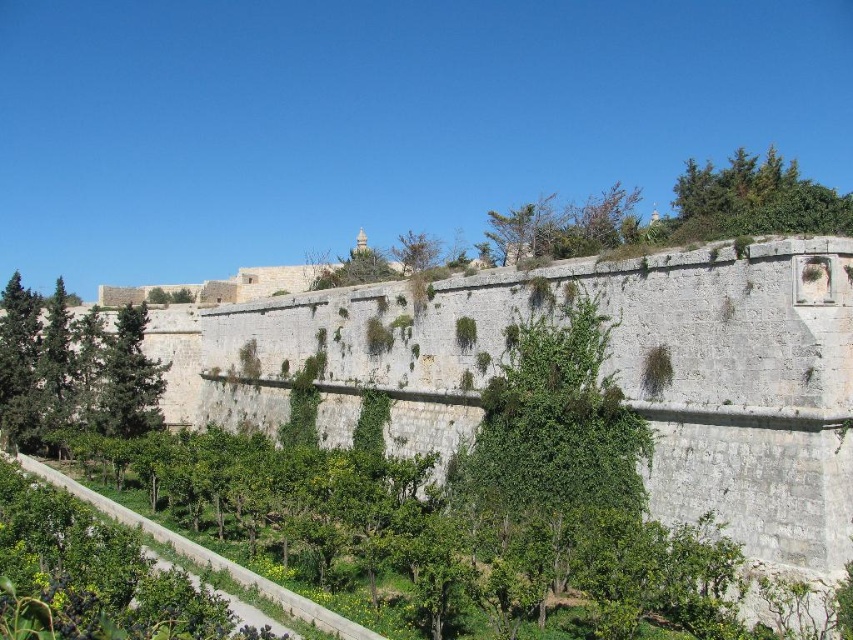
Question: Which point is farther to the camera?

Choices:
 (A) (703, 220)
 (B) (544, 458)
 (C) (404, 256)
 (D) (126, 339)

Answer: (C)

Question: Is green leafy tree at upper right below green leafy tree at left?

Choices:
 (A) yes
 (B) no

Answer: (B)

Question: Which point is farther from the camera taking this photo?

Choices:
 (A) (16, 392)
 (B) (154, 417)
 (C) (416, 268)

Answer: (C)

Question: Which of these objects is positioned farthest from the green leafy tree at upper left?

Choices:
 (A) green leafy tree at left
 (B) green leafy tree at upper center
 (C) green leafy tree at center
 (D) green leafy tree at upper right

Answer: (D)

Question: Considering the relative positions of green leafy tree at center and green leafy tree at upper center in the image provided, where is green leafy tree at center located with respect to green leafy tree at upper center?

Choices:
 (A) above
 (B) below

Answer: (B)

Question: Is green leafy tree at upper left below green leafy tree at upper right?

Choices:
 (A) no
 (B) yes

Answer: (B)